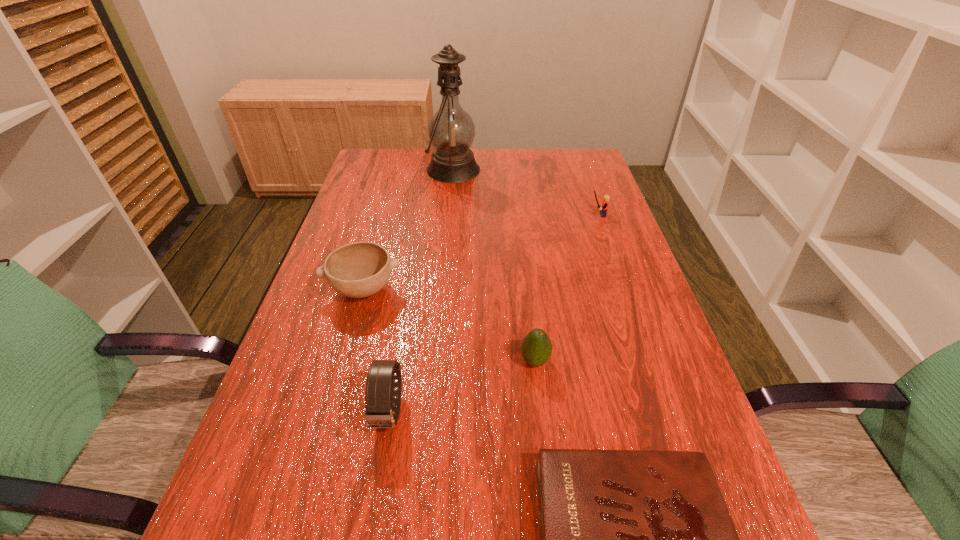
The width and height of the screenshot is (960, 540). I want to click on oil lamp, so click(x=451, y=130).

Image resolution: width=960 pixels, height=540 pixels. I want to click on the tallest object, so click(451, 130).

The height and width of the screenshot is (540, 960). I want to click on the fifth shortest object, so click(x=380, y=392).

Where is `the fifth farthest object`? the fifth farthest object is located at coordinates (380, 392).

You are a GUI agent. You are given a task and a screenshot of the screen. Output one action in this format:
    pyautogui.click(x=<x>, y=<y>)
    Task: Click on the Lego
    
    Given the screenshot: What is the action you would take?
    pyautogui.click(x=605, y=203)

You are a GUI agent. You are given a task and a screenshot of the screen. Output one action in this format:
    pyautogui.click(x=<x>, y=<y>)
    Task: Click on the avocado
    The width and height of the screenshot is (960, 540).
    Given the screenshot: What is the action you would take?
    pyautogui.click(x=536, y=348)

Identify the location of bowl. (360, 269).

At what (x,y) coordinates should I click in order to perform the action: click on blank space located on the right of the oil lamp. Please return your answer as a coordinate pair (x, y). This screenshot has width=960, height=540. Looking at the image, I should click on (559, 170).

This screenshot has height=540, width=960. I want to click on vacant region located 0.140m on the face of the fifth farthest object, so click(370, 531).

The height and width of the screenshot is (540, 960). I want to click on free location located on the front-facing side of the fifth nearest object, so click(553, 215).